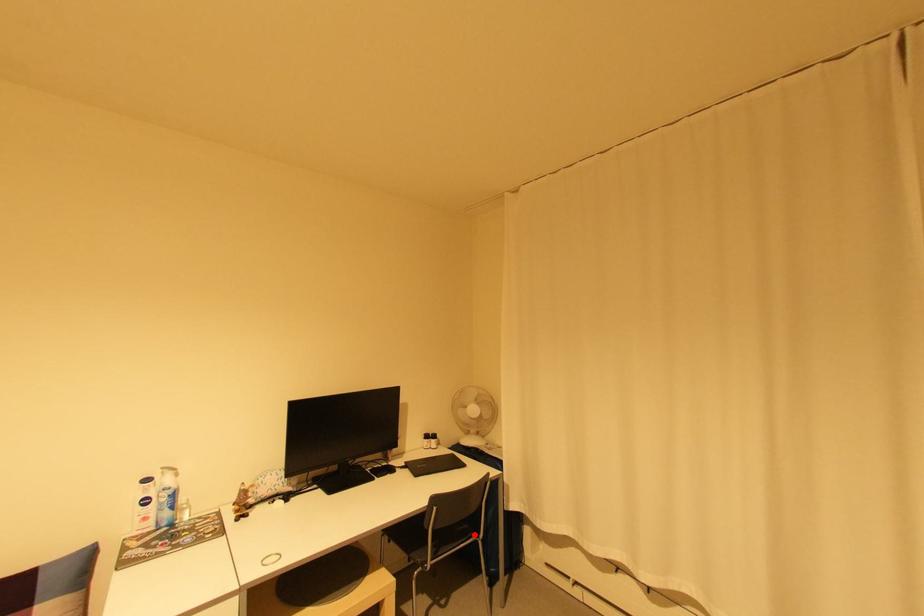
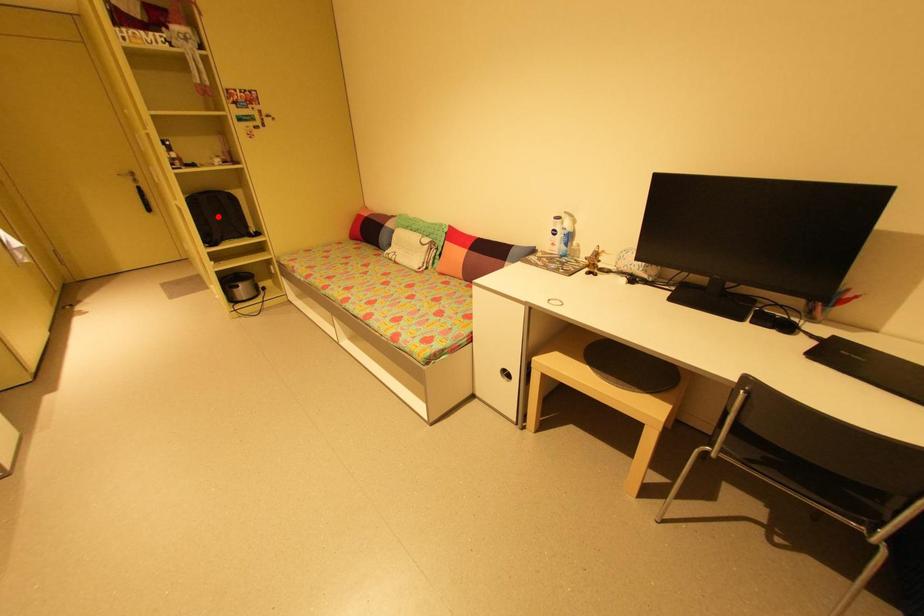
I am providing you with two images of the same scene from different viewpoints. A red point is marked on the first image and another point is marked on the second image. Does the point marked in image1 correspond to the same location as the one in image2?

No